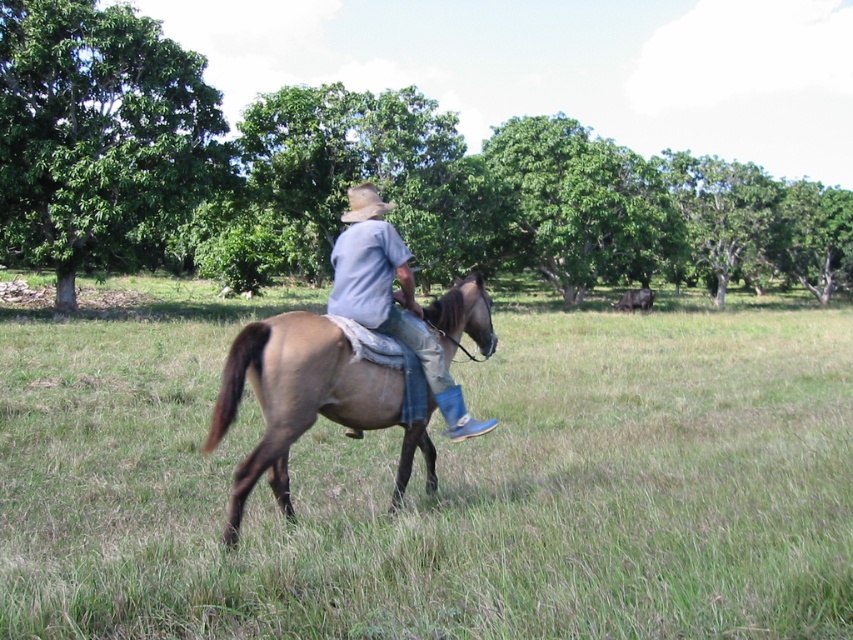
Question: Which point is closer to the camera taking this photo?

Choices:
 (A) (184, 483)
 (B) (457, 321)
 (C) (379, 196)

Answer: (B)

Question: Estimate the real-world distances between objects in this image. Which object is farther from the denim jeans at center?

Choices:
 (A) brown felt cowboy hat at center
 (B) brown leather horse at center

Answer: (B)

Question: Can you confirm if brown matte/suede horse at center is thinner than brown felt cowboy hat at center?

Choices:
 (A) yes
 (B) no

Answer: (A)

Question: Which of the following is the farthest from the observer?

Choices:
 (A) (469, 385)
 (B) (386, 211)
 (C) (341, 276)
 (D) (340, 355)

Answer: (A)

Question: Is denim jeans at center closer to camera compared to brown felt cowboy hat at center?

Choices:
 (A) no
 (B) yes

Answer: (B)

Question: Can you confirm if brown matte/suede horse at center is smaller than denim jeans at center?

Choices:
 (A) no
 (B) yes

Answer: (B)